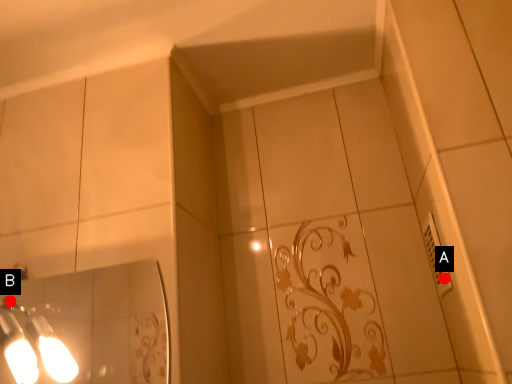
Question: Two points are circled on the image, labeled by A and B beside each circle. Which point is farther to the camera?

Choices:
 (A) A is further
 (B) B is further

Answer: (B)